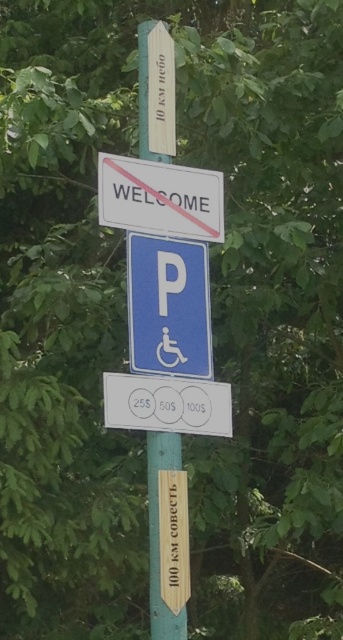
Question: Which object is closer to the camera taking this photo?

Choices:
 (A) blue plastic parking sign at center
 (B) green wooden pole at center

Answer: (A)

Question: Based on their relative distances, which object is nearer to the green wooden pole at center?

Choices:
 (A) blue plastic parking sign at center
 (B) white plastic sign at upper center

Answer: (B)

Question: Can you confirm if blue plastic parking sign at center is thinner than white plastic sign at upper center?

Choices:
 (A) yes
 (B) no

Answer: (A)

Question: Is blue plastic parking sign at center above white plastic sign at upper center?

Choices:
 (A) no
 (B) yes

Answer: (A)

Question: Estimate the real-world distances between objects in this image. Which object is closer to the blue plastic parking sign at center?

Choices:
 (A) green wooden pole at center
 (B) white plastic sign at upper center

Answer: (B)

Question: Is white plastic sign at upper center bigger than green wooden pole at center?

Choices:
 (A) no
 (B) yes

Answer: (B)